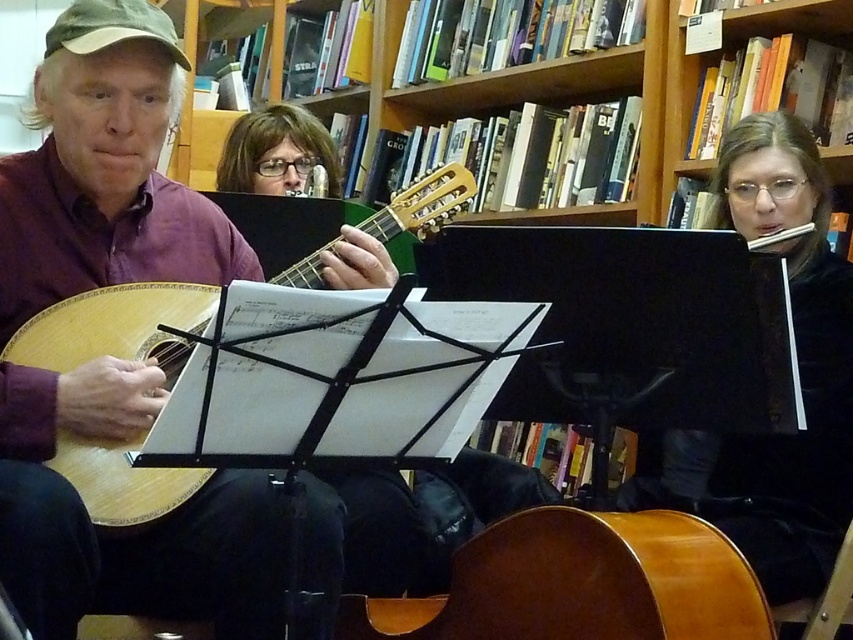
You are a photographer setting up a shoot in this scene. You need to position a spotlight so that it illuminates both the matte wood guitar at left and the black velvet dress at center without casting shadows over the bookshelves in the background. Considering their heights, which object should be placed closer to the spotlight to avoid shadowing the shelves?

The matte wood guitar at left is much taller than the black velvet dress at center. To prevent shadows from the taller guitar from falling on the bookshelves, the spotlight should be positioned closer to the matte wood guitar at left so that its shadow is minimized or directed away from the shelves.

Where is the matte wood guitar at left located in the image?

The matte wood guitar at left is located at point (105, 172) in the image.

You are a photographer setting up a shoot in this scene. You need to position a light source to the left of the matte wood guitar at left and another to the right of the black velvet dress at center. Which light source will be closer to the camera?

The light source to the right of the black velvet dress at center will be closer to the camera because the matte wood guitar at left is wider than the black velvet dress at center, making the distance from the dress to the camera shorter.